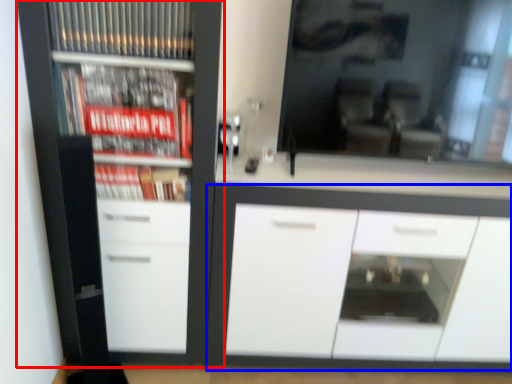
Question: Which point is closer to the camera, cupboard (highlighted by a red box) or cabinetry (highlighted by a blue box)?

Choices:
 (A) cupboard
 (B) cabinetry

Answer: (A)